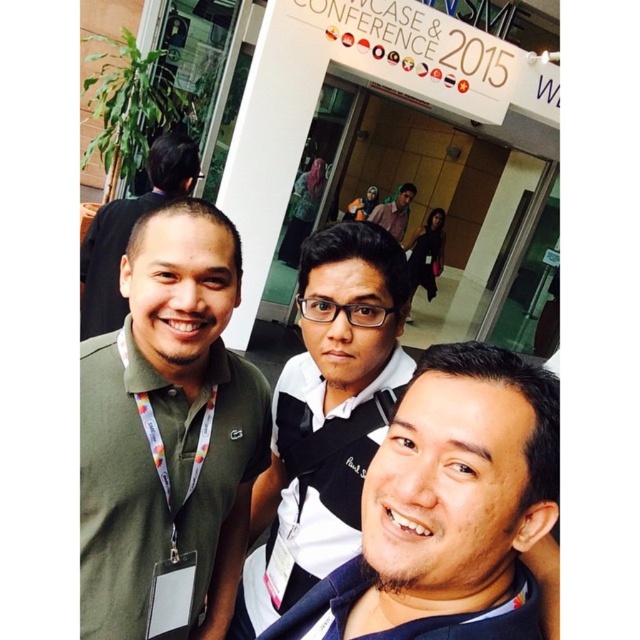
Does dark blue fabric shirt at center lie behind green matte shirt at left?

No, dark blue fabric shirt at center is in front of green matte shirt at left.

Between point (534, 536) and point (134, 205), which one is positioned in front?

Positioned in front is point (534, 536).

Locate an element on the screen. The width and height of the screenshot is (640, 640). dark blue fabric shirt at center is located at coordinates (449, 508).

Is black matte shirt at center further to the viewer compared to green matte shirt at left?

No, it is not.

Does black matte shirt at center appear on the right side of green matte shirt at left?

Yes, black matte shirt at center is to the right of green matte shirt at left.

Image resolution: width=640 pixels, height=640 pixels. What do you see at coordinates (324, 417) in the screenshot?
I see `black matte shirt at center` at bounding box center [324, 417].

Locate an element on the screen. This screenshot has width=640, height=640. black matte shirt at center is located at coordinates (324, 417).

Image resolution: width=640 pixels, height=640 pixels. What do you see at coordinates (168, 428) in the screenshot?
I see `green fabric shirt at left` at bounding box center [168, 428].

Which of these two, green fabric shirt at left or dark blue fabric shirt at center, stands shorter?

With less height is dark blue fabric shirt at center.

The width and height of the screenshot is (640, 640). What do you see at coordinates (168, 428) in the screenshot?
I see `green fabric shirt at left` at bounding box center [168, 428].

This screenshot has width=640, height=640. Identify the location of green fabric shirt at left. (168, 428).